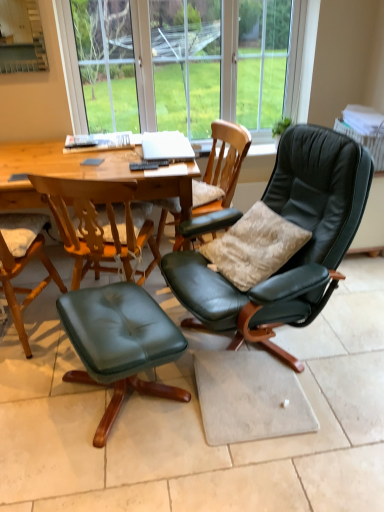
The width and height of the screenshot is (384, 512). What are the coordinates of `free spot above green leather ottoman at lower left (from a real-world perspective)` in the screenshot? It's located at (89, 316).